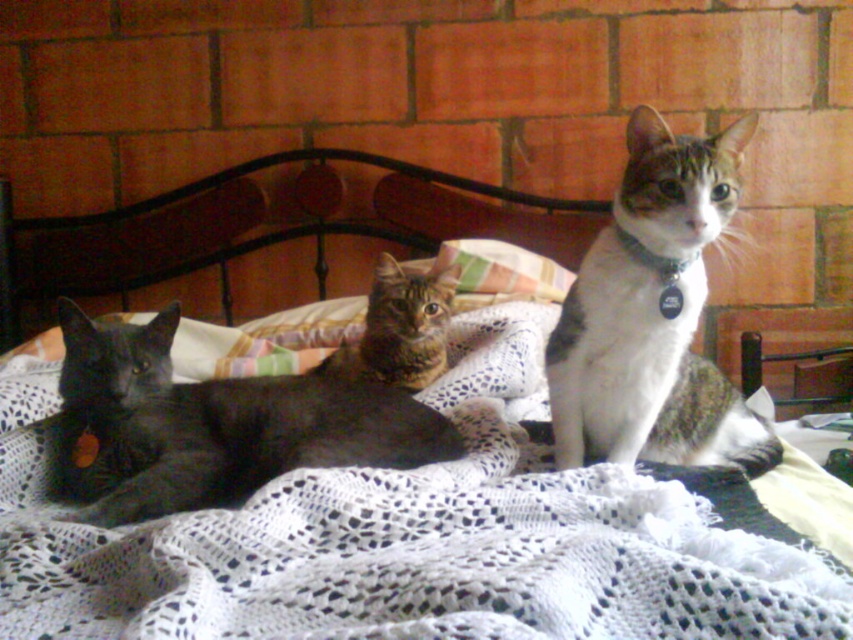
Which is behind, point (695, 234) or point (321, 400)?

Point (321, 400)

The height and width of the screenshot is (640, 853). I want to click on white fur at center, so click(x=653, y=314).

Who is more forward, (x=683, y=145) or (x=525, y=200)?

Point (x=683, y=145)

Does white fur at center lie in front of metallic black headboard at center?

Yes, white fur at center is closer to the viewer.

The image size is (853, 640). In order to click on white fur at center in this screenshot , I will do `click(653, 314)`.

From the picture: Can you confirm if metallic black headboard at center is wider than striped fabric pillow at center?

Indeed, metallic black headboard at center has a greater width compared to striped fabric pillow at center.

The height and width of the screenshot is (640, 853). Describe the element at coordinates (254, 227) in the screenshot. I see `metallic black headboard at center` at that location.

Which is in front, point (561, 214) or point (459, 282)?

Point (459, 282) is in front.

The image size is (853, 640). What are the coordinates of `metallic black headboard at center` in the screenshot? It's located at (254, 227).